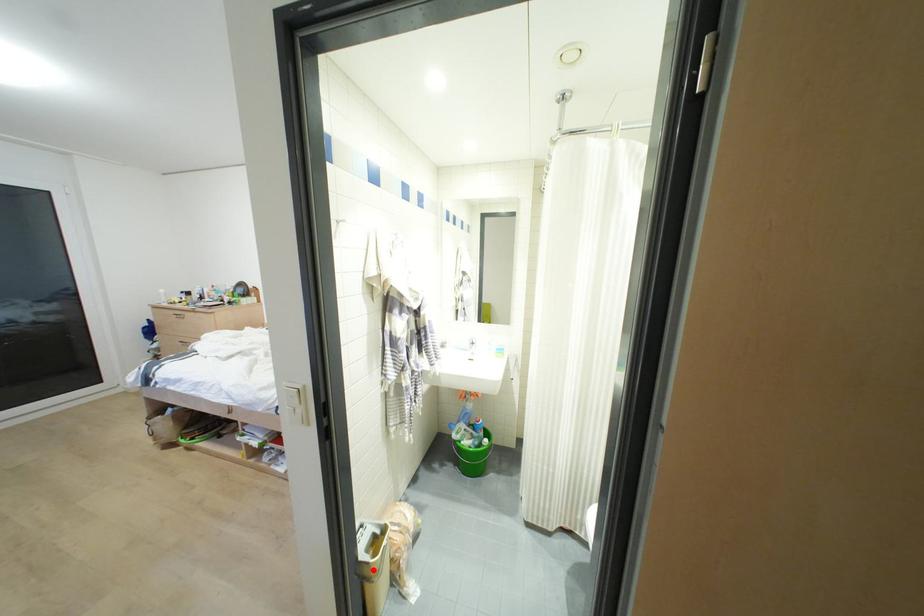
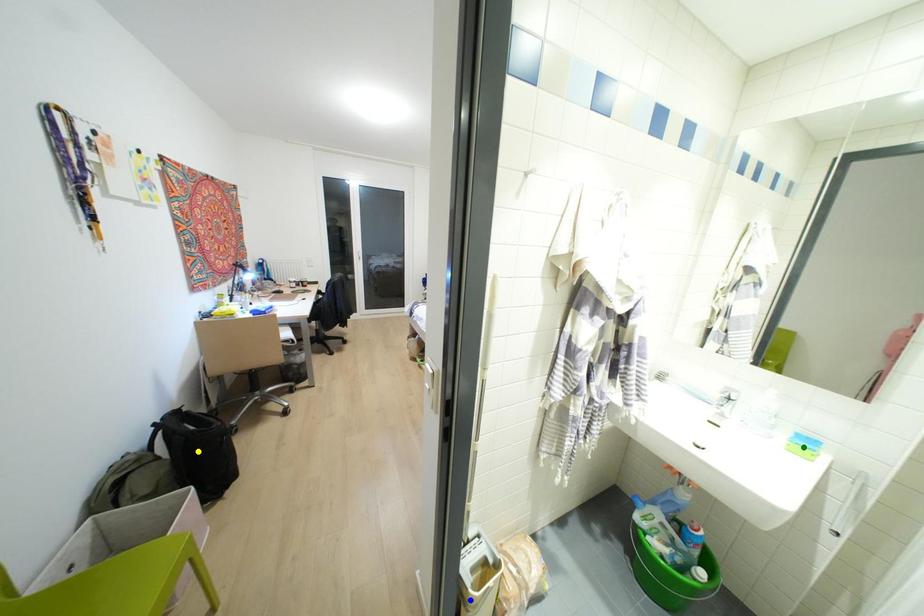
Question: I am providing you with two images of the same scene from different viewpoints. A red point is marked on the first image. You are given multiple points on the second image. Can you choose the point in image 2 that corresponds to the point in image 1?

Choices:
 (A) blue point
 (B) yellow point
 (C) green point

Answer: (A)